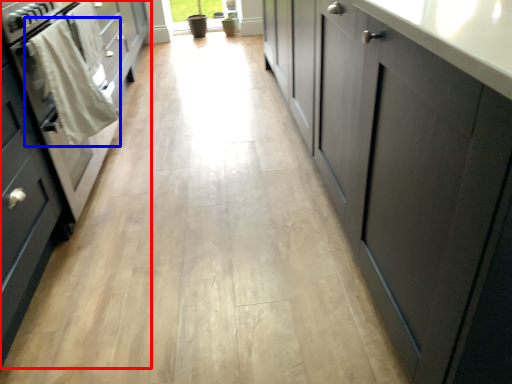
Question: Which of the following is the closest to the observer, cabinetry (highlighted by a red box) or laundry (highlighted by a blue box)?

Choices:
 (A) cabinetry
 (B) laundry

Answer: (A)